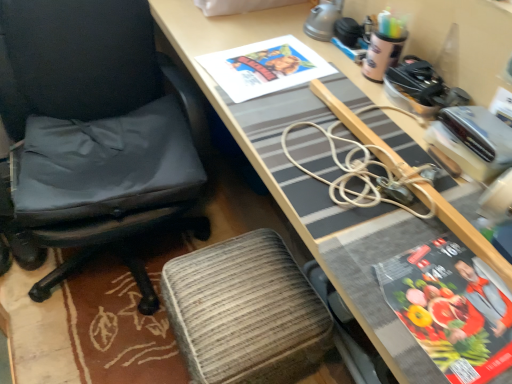
I want to click on matte paper magazine at right, so click(x=451, y=308).

Describe the element at coordinates (313, 179) in the screenshot. The image size is (512, 384). I see `wooden desk at center` at that location.

Locate an element on the screen. black fabric chair at left is located at coordinates (97, 131).

I want to click on textured fabric stool at lower center, so click(245, 312).

Describe the element at coordinates (264, 67) in the screenshot. The image size is (512, 384). I see `matte paper book cover at upper center` at that location.

Find the location of a particular element. The height and width of the screenshot is (384, 512). matte paper magazine at right is located at coordinates (451, 308).

How distant is matte paper magazine at right from wooden desk at center?

matte paper magazine at right is 11.63 inches away from wooden desk at center.

Based on the photo, which of these two, matte paper magazine at right or wooden desk at center, is bigger?

wooden desk at center.

Which object is thinner, matte paper magazine at right or wooden desk at center?

Thinner between the two is matte paper magazine at right.

From a real-world perspective, which object rests below the other?

wooden desk at center is physically lower.

Which of these two, wooden desk at center or black fabric chair at left, is wider?

With larger width is black fabric chair at left.

Is wooden desk at center taller than black fabric chair at left?

Yes, wooden desk at center is taller than black fabric chair at left.

Is wooden desk at center next to black fabric chair at left?

No, wooden desk at center is not with black fabric chair at left.

From a real-world perspective, is wooden desk at center physically located above or below black fabric chair at left?

From a real-world perspective, wooden desk at center is physically above black fabric chair at left.

Considering their positions, is wooden desk at center located in front of or behind matte paper book cover at upper center?

Visually, wooden desk at center is located in front of matte paper book cover at upper center.

Between wooden desk at center and matte paper book cover at upper center, which one appears on the left side from the viewer's perspective?

matte paper book cover at upper center is more to the left.

Is matte paper book cover at upper center inside wooden desk at center?

Yes, matte paper book cover at upper center is a part of wooden desk at center.

Based on the photo, could you tell me if textured fabric stool at lower center is facing matte paper book cover at upper center?

No, textured fabric stool at lower center is not oriented towards matte paper book cover at upper center.

Is textured fabric stool at lower center positioned behind matte paper book cover at upper center?

No, textured fabric stool at lower center is closer to the camera.

Are textured fabric stool at lower center and matte paper book cover at upper center far apart?

textured fabric stool at lower center is actually quite close to matte paper book cover at upper center.

From a real-world perspective, is textured fabric stool at lower center positioned over black fabric chair at left based on gravity?

Incorrect, from a real-world perspective, textured fabric stool at lower center is lower than black fabric chair at left.

In the scene shown: From the image's perspective, who appears lower, textured fabric stool at lower center or black fabric chair at left?

textured fabric stool at lower center, from the image's perspective.

In terms of height, does textured fabric stool at lower center look taller or shorter compared to black fabric chair at left?

Considering their sizes, textured fabric stool at lower center has less height than black fabric chair at left.

Which object is positioned more to the left, textured fabric stool at lower center or black fabric chair at left?

black fabric chair at left is more to the left.

How different are the orientations of matte paper book cover at upper center and textured fabric stool at lower center in degrees?

There is a 85-degree angle between the facing directions of matte paper book cover at upper center and textured fabric stool at lower center.

From a real-world perspective, is matte paper book cover at upper center under textured fabric stool at lower center?

No.

Would you consider matte paper book cover at upper center to be distant from textured fabric stool at lower center?

No, there isn't a large distance between matte paper book cover at upper center and textured fabric stool at lower center.

Considering the relative sizes of matte paper book cover at upper center and matte paper magazine at right in the image provided, is matte paper book cover at upper center shorter than matte paper magazine at right?

No.

Choose the correct answer: Is matte paper book cover at upper center inside matte paper magazine at right or outside it?

matte paper book cover at upper center is not enclosed by matte paper magazine at right.

Which object is further away from the camera, matte paper book cover at upper center or matte paper magazine at right?

Positioned behind is matte paper book cover at upper center.

Is point (286, 73) less distant than point (467, 302)?

No, it is behind (467, 302).

Locate an element on the screen. The image size is (512, 384). paperback book that is below the wooden desk at center (from the image's perspective) is located at coordinates (451, 308).

Find the location of a particular element. The image size is (512, 384). chair located above the wooden desk at center (from the image's perspective) is located at coordinates (97, 131).

From the image, which object appears to be nearer to matte paper book cover at upper center, black fabric chair at left or matte paper magazine at right?

black fabric chair at left is closer to matte paper book cover at upper center.

Looking at the image, which one is located closer to wooden desk at center, black fabric chair at left or matte paper book cover at upper center?

The object closer to wooden desk at center is matte paper book cover at upper center.

Which object lies further to the anchor point black fabric chair at left, wooden desk at center or matte paper magazine at right?

matte paper magazine at right is positioned further to the anchor black fabric chair at left.

Considering their positions, is wooden desk at center positioned closer to matte paper magazine at right than black fabric chair at left?

wooden desk at center.

When comparing their distances from matte paper book cover at upper center, does wooden desk at center or textured fabric stool at lower center seem closer?

wooden desk at center.

Considering their positions, is wooden desk at center positioned further to matte paper book cover at upper center than matte paper magazine at right?

matte paper magazine at right lies further to matte paper book cover at upper center than the other object.

Estimate the real-world distances between objects in this image. Which object is further from matte paper book cover at upper center, black fabric chair at left or wooden desk at center?

The object further to matte paper book cover at upper center is black fabric chair at left.

When comparing their distances from textured fabric stool at lower center, does wooden desk at center or matte paper magazine at right seem further?

matte paper magazine at right lies further to textured fabric stool at lower center than the other object.

The width and height of the screenshot is (512, 384). Find the location of `paperback book between matte paper book cover at upper center and textured fabric stool at lower center in the vertical direction`. paperback book between matte paper book cover at upper center and textured fabric stool at lower center in the vertical direction is located at coordinates (451, 308).

Find the location of a particular element. The image size is (512, 384). paperback book positioned between wooden desk at center and matte paper book cover at upper center from near to far is located at coordinates (451, 308).

Where is `book cover located between black fabric chair at left and wooden desk at center in the left-right direction`? book cover located between black fabric chair at left and wooden desk at center in the left-right direction is located at coordinates (264, 67).

The height and width of the screenshot is (384, 512). What are the coordinates of `chair that lies between matte paper book cover at upper center and textured fabric stool at lower center from top to bottom` in the screenshot? It's located at (97, 131).